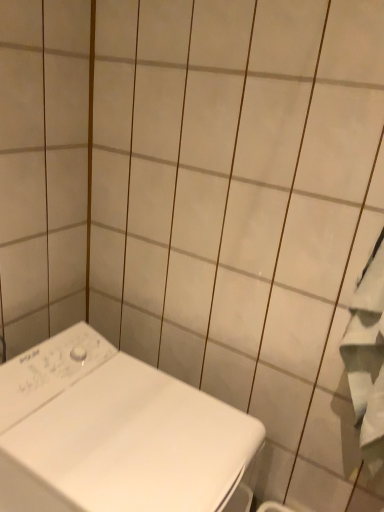
Describe the element at coordinates (114, 433) in the screenshot. The width and height of the screenshot is (384, 512). I see `white glossy toilet at lower left` at that location.

From the picture: Measure the distance between white glossy toilet at lower left and camera.

A distance of 29.72 inches exists between white glossy toilet at lower left and camera.

Measure the distance between point (227, 476) and camera.

The distance of point (227, 476) from camera is 33.58 inches.

Locate an element on the screen. This screenshot has height=512, width=384. white glossy toilet at lower left is located at coordinates (114, 433).

Image resolution: width=384 pixels, height=512 pixels. I want to click on white glossy toilet at lower left, so click(114, 433).